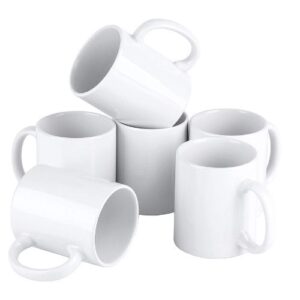
The height and width of the screenshot is (300, 300). In order to click on white mug in this screenshot , I will do `click(70, 210)`, `click(90, 157)`, `click(218, 190)`, `click(257, 139)`, `click(147, 164)`, `click(142, 103)`.